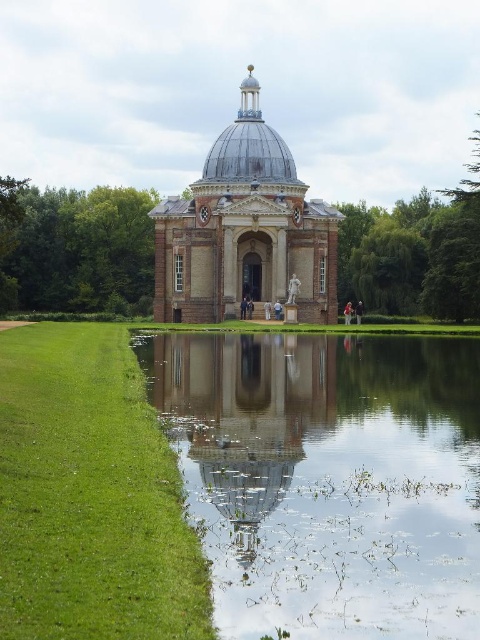
You are an architect designing a new garden layout. You need to place a decorative fountain between the clear water at center and the metallic silver dome at center. Based on their sizes, which object should the fountain be closer to?

The clear water at center is shorter than the metallic silver dome at center, so the fountain should be placed closer to the metallic silver dome at center to maintain visual balance.